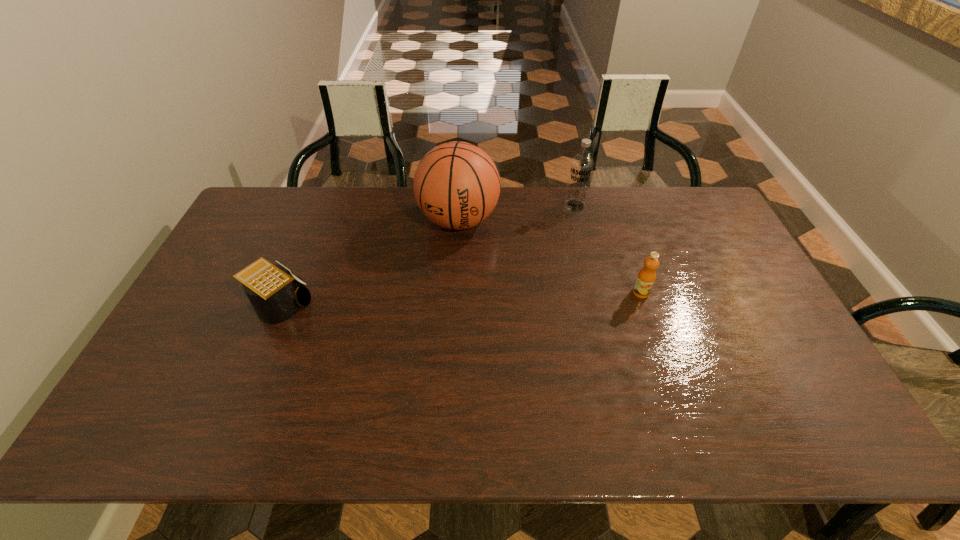
Find the location of a particular element. The image size is (960, 540). vacant space on the desktop that is between the calculator and the rightmost object and is positioned on the surface of the basketball near the brand logo is located at coordinates (439, 300).

Image resolution: width=960 pixels, height=540 pixels. Find the location of `free space on the desktop that is between the shortest object and the orange juice and is positioned on the front label of the second object from right to left`. free space on the desktop that is between the shortest object and the orange juice and is positioned on the front label of the second object from right to left is located at coordinates (498, 298).